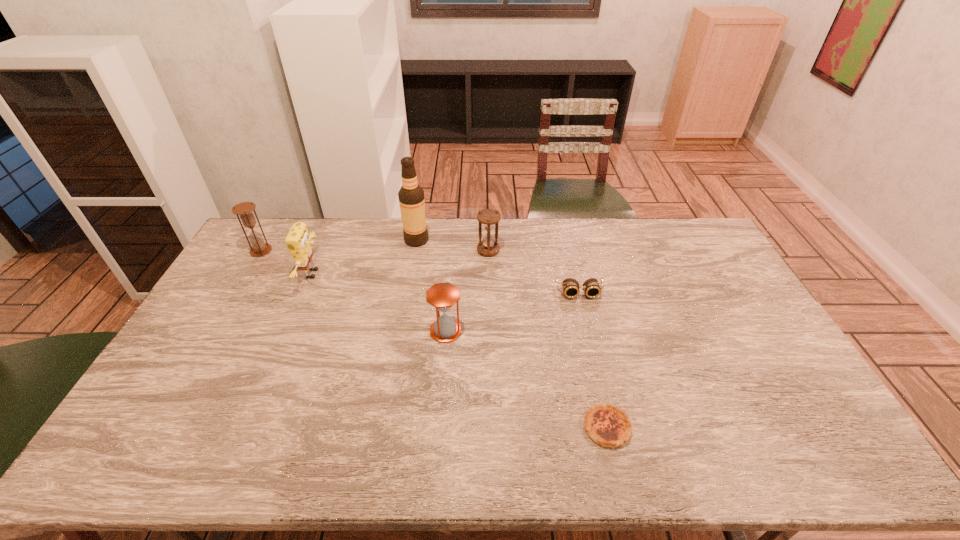
Find the location of a particular element. Image resolution: width=960 pixels, height=540 pixels. free area in between the nearest object and the sixth farthest object is located at coordinates (526, 379).

I want to click on vacant area between the second shortest object and the tallest object, so click(x=498, y=266).

This screenshot has width=960, height=540. What are the coordinates of `free spot between the nearest object and the alcohol` in the screenshot? It's located at (512, 334).

Locate an element on the screen. This screenshot has height=540, width=960. vacant area that lies between the alcohol and the fifth object from left to right is located at coordinates (452, 245).

Where is `vacant region between the tallest object and the leftmost object`? The image size is (960, 540). vacant region between the tallest object and the leftmost object is located at coordinates (339, 246).

The width and height of the screenshot is (960, 540). In order to click on vacant area between the rightmost hourglass and the fifth object from right to left in this screenshot , I will do `click(452, 245)`.

You are a GUI agent. You are given a task and a screenshot of the screen. Output one action in this format:
    pyautogui.click(x=<x>, y=<y>)
    Task: Click on the object that ranks as the sixth closest to the leftmost hourglass
    Image resolution: width=960 pixels, height=540 pixels.
    Given the screenshot: What is the action you would take?
    pyautogui.click(x=609, y=426)

Identify the location of the closest object relative to the third object from right to left. Image resolution: width=960 pixels, height=540 pixels. (x=411, y=196).

Locate which hourglass is the closest to the leftmost object. Please provide its 2D coordinates. Your answer should be formatted as a tuple, i.e. [(x, y)], where the tuple contains the x and y coordinates of a point satisfying the conditions above.

[(442, 296)]

Choose which hourglass is the nearest neighbor to the alcohol. Please provide its 2D coordinates. Your answer should be formatted as a tuple, i.e. [(x, y)], where the tuple contains the x and y coordinates of a point satisfying the conditions above.

[(488, 218)]